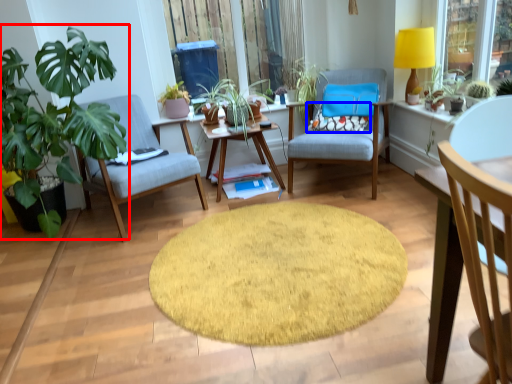
Question: Which object is further to the camera taking this photo, houseplant (highlighted by a red box) or pillow (highlighted by a blue box)?

Choices:
 (A) houseplant
 (B) pillow

Answer: (B)